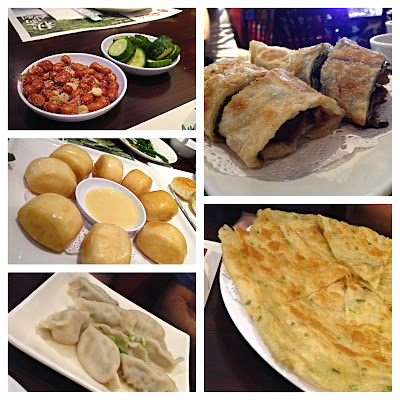
Find the location of a particular element. This screenshot has height=400, width=400. article or magazine is located at coordinates (56, 28).